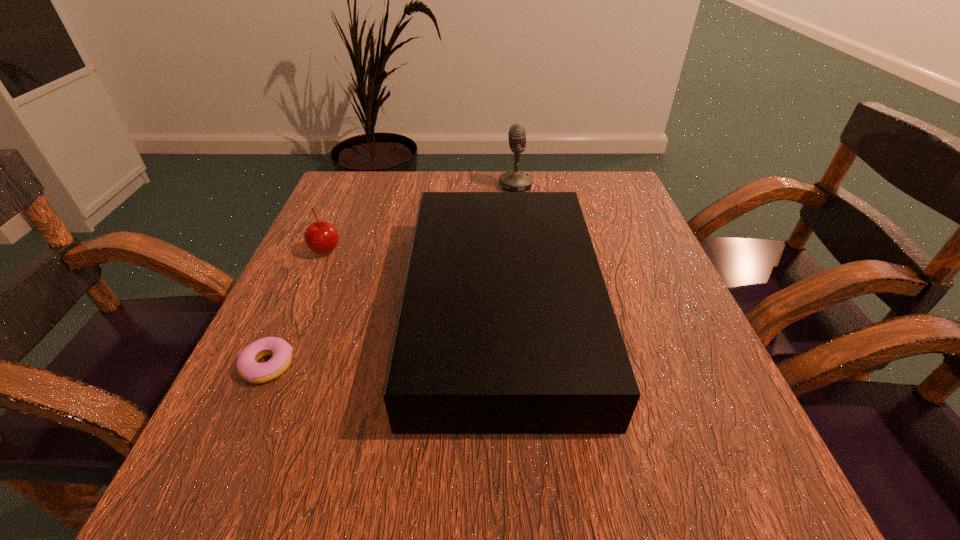
At what (x,y) coordinates should I click in order to perform the action: click on the farthest object. Please return your answer as a coordinate pair (x, y). Looking at the image, I should click on (514, 180).

Image resolution: width=960 pixels, height=540 pixels. I want to click on microphone, so click(514, 180).

The width and height of the screenshot is (960, 540). I want to click on the third shortest object, so click(505, 326).

This screenshot has width=960, height=540. In order to click on cherry in this screenshot , I will do pos(322,237).

The image size is (960, 540). Identify the location of the shortest object. (247, 364).

Image resolution: width=960 pixels, height=540 pixels. Identify the location of vacant space located 0.110m on the front-facing side of the microphone. (456, 186).

I want to click on vacant space located 0.190m on the front-facing side of the microphone, so click(x=425, y=186).

Where is `free space located 0.390m on the front-facing side of the microphone`? This screenshot has width=960, height=540. free space located 0.390m on the front-facing side of the microphone is located at coordinates (348, 186).

Where is `vacant space situated 0.170m at the front of the second tallest object for disc insertion`? vacant space situated 0.170m at the front of the second tallest object for disc insertion is located at coordinates (319, 310).

The image size is (960, 540). I want to click on free space located at the front of the second tallest object for disc insertion, so click(286, 310).